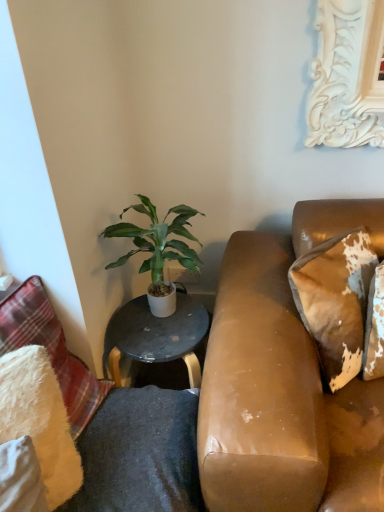
Question: From their relative heights in the image, would you say leather-like brown pillow at right, the 1th pillow viewed from the right, is taller or shorter than white glossy table at center?

Choices:
 (A) tall
 (B) short

Answer: (B)

Question: Considering their positions, is leather-like brown pillow at right, placed as the third pillow when sorted from left to right, located in front of or behind white glossy table at center?

Choices:
 (A) front
 (B) behind

Answer: (A)

Question: Which of these objects is positioned farthest from the fluffy white pillow at left, the 1th pillow in the left-to-right sequence?

Choices:
 (A) green leafy plant at center
 (B) white glossy table at center
 (C) leather-like brown pillow at right, placed as the third pillow when sorted from left to right
 (D) white fluffy pillow at lower left, placed as the 2th pillow when sorted from right to left

Answer: (C)

Question: Based on their relative distances, which object is nearer to the fluffy white pillow at left, which is the third pillow from right to left?

Choices:
 (A) white fluffy pillow at lower left, placed as the 2th pillow when sorted from right to left
 (B) green leafy plant at center
 (C) white glossy table at center
 (D) leather-like brown pillow at right, the 1th pillow viewed from the right

Answer: (A)